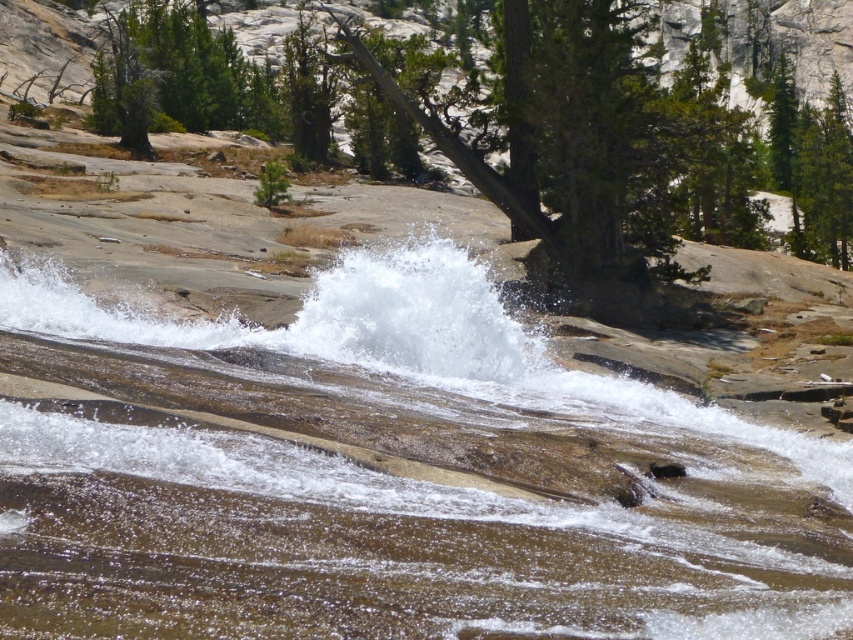
Question: Which point is farther to the camera?

Choices:
 (A) (421, 433)
 (B) (622, 93)

Answer: (B)

Question: Is white frothy water at center further to camera compared to green textured tree at center?

Choices:
 (A) no
 (B) yes

Answer: (A)

Question: Is white frothy water at center below green textured tree at center?

Choices:
 (A) no
 (B) yes

Answer: (B)

Question: Does white frothy water at center appear over green textured tree at center?

Choices:
 (A) yes
 (B) no

Answer: (B)